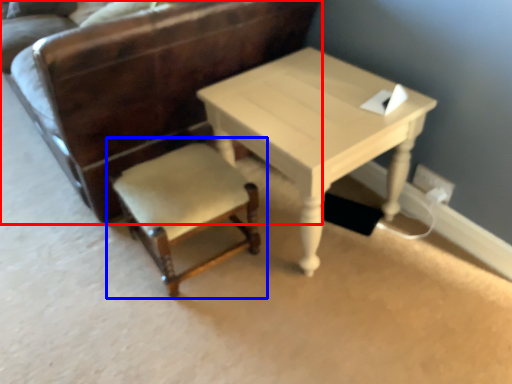
Question: Among these objects, which one is nearest to the camera, chair (highlighted by a red box) or chair (highlighted by a blue box)?

Choices:
 (A) chair
 (B) chair

Answer: (A)